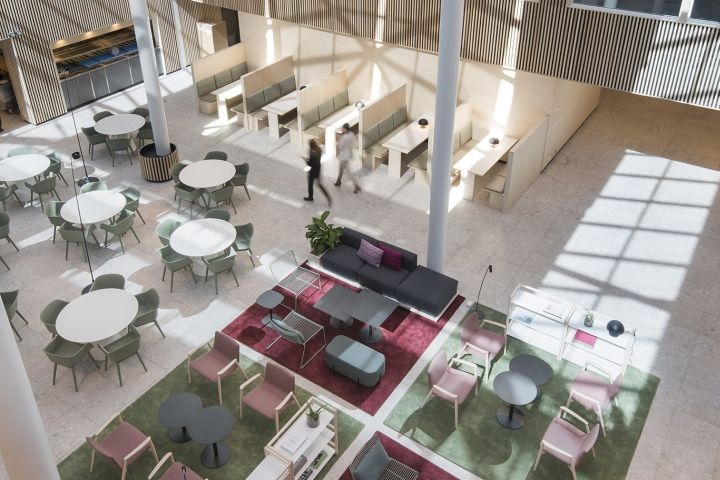
Image resolution: width=720 pixels, height=480 pixels. Identify the location of benches. (225, 84), (237, 111), (260, 109), (317, 130), (351, 145), (371, 147), (376, 268).